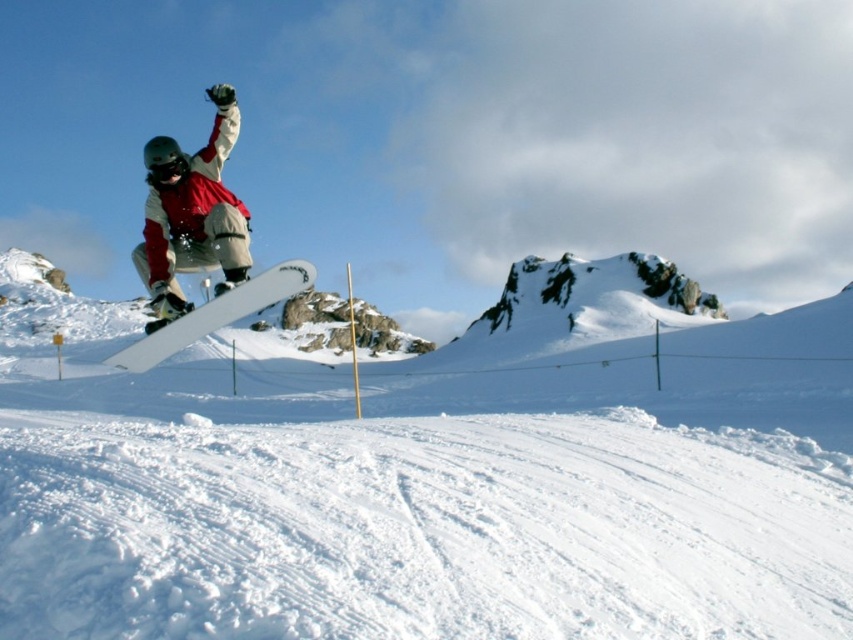
You are a photographer capturing the snowboarder midair. You need to ensure that the matte red snowboarder at center and the white matte snowboard at center are both visible in your shot. Based on their positions, which one should you focus on first to capture both in the frame?

The matte red snowboarder at center is located above the white matte snowboard at center. To capture both in the frame, focus on the matte red snowboarder at center first since it is higher up, ensuring the lower white matte snowboard at center remains within the shot.

You are a snowboarder who just jumped off a ramp and are now midair. You want to land on the snowboard located at the center of the image. Based on your current position at point (198, 243), can you reach the snowboard at center?

The point (198, 243) indicates the matte white snowboard at center, so yes, you can reach the snowboard at center from your current position.